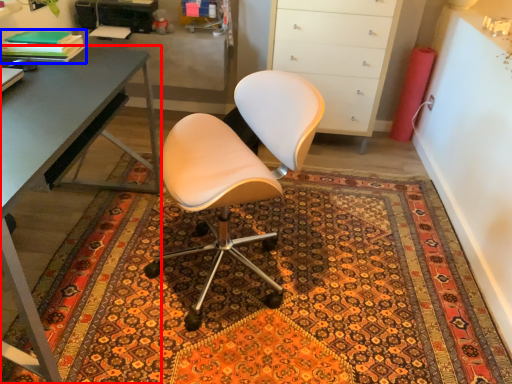
Question: Which point is closer to the camera, desk (highlighted by a red box) or book (highlighted by a blue box)?

Choices:
 (A) desk
 (B) book

Answer: (A)